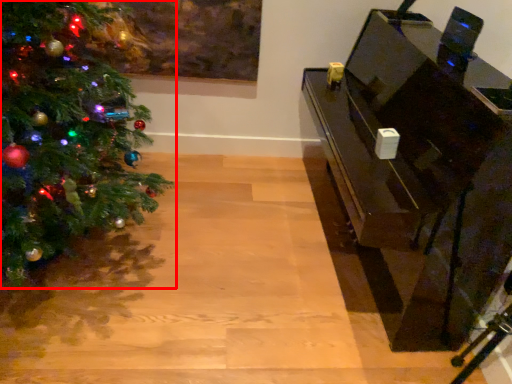
Question: From the image's perspective, where is christmas tree (annotated by the red box) located in relation to furniture in the image?

Choices:
 (A) below
 (B) above

Answer: (B)